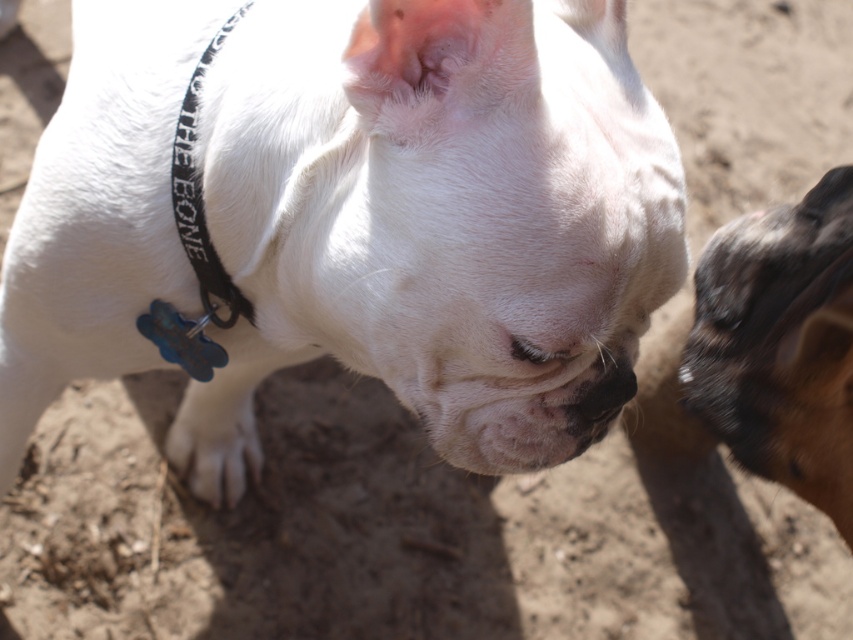
Does brown fur at right appear on the left side of white fur paw at lower center?

Incorrect, brown fur at right is not on the left side of white fur paw at lower center.

Describe the element at coordinates (780, 344) in the screenshot. This screenshot has width=853, height=640. I see `brown fur at right` at that location.

Is point (813, 436) less distant than point (213, 433)?

Yes, point (813, 436) is closer to viewer.

I want to click on brown fur at right, so click(x=780, y=344).

Which of these two, white fur paw at lower center or black fabric neckband at left, stands shorter?

white fur paw at lower center

Is white fur paw at lower center below black fabric neckband at left?

Yes.

In order to click on white fur paw at lower center in this screenshot , I will do `click(215, 438)`.

You are a GUI agent. You are given a task and a screenshot of the screen. Output one action in this format:
    pyautogui.click(x=<x>, y=<y>)
    Task: Click on the white fur paw at lower center
    Image resolution: width=853 pixels, height=640 pixels.
    Given the screenshot: What is the action you would take?
    pyautogui.click(x=215, y=438)

In the scene shown: Is brown fur at right bigger than black fabric neckband at left?

Indeed, brown fur at right has a larger size compared to black fabric neckband at left.

How distant is brown fur at right from black fabric neckband at left?

brown fur at right is 25.48 inches away from black fabric neckband at left.

At what (x,y) coordinates should I click in order to perform the action: click on brown fur at right. Please return your answer as a coordinate pair (x, y). Looking at the image, I should click on (780, 344).